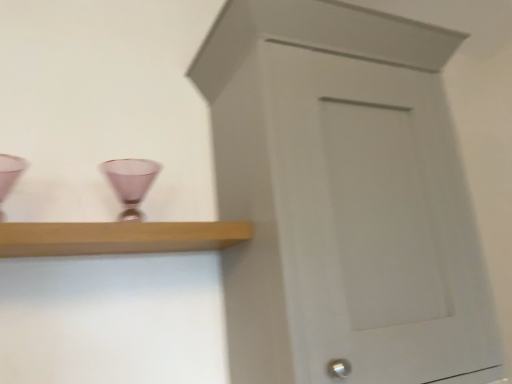
Question: Looking at their shapes, would you say light wood shelf at upper left is wider or thinner than matte pink glass at center?

Choices:
 (A) wide
 (B) thin

Answer: (A)

Question: From the image's perspective, is light wood shelf at upper left located above or below matte pink glass at center?

Choices:
 (A) above
 (B) below

Answer: (B)

Question: Which is nearer to the light wood shelf at upper left?

Choices:
 (A) matte pink glass at center
 (B) white painted wood cupboard at center

Answer: (A)

Question: Which object is positioned closest to the matte pink glass at center?

Choices:
 (A) light wood shelf at upper left
 (B) white painted wood cupboard at center

Answer: (A)